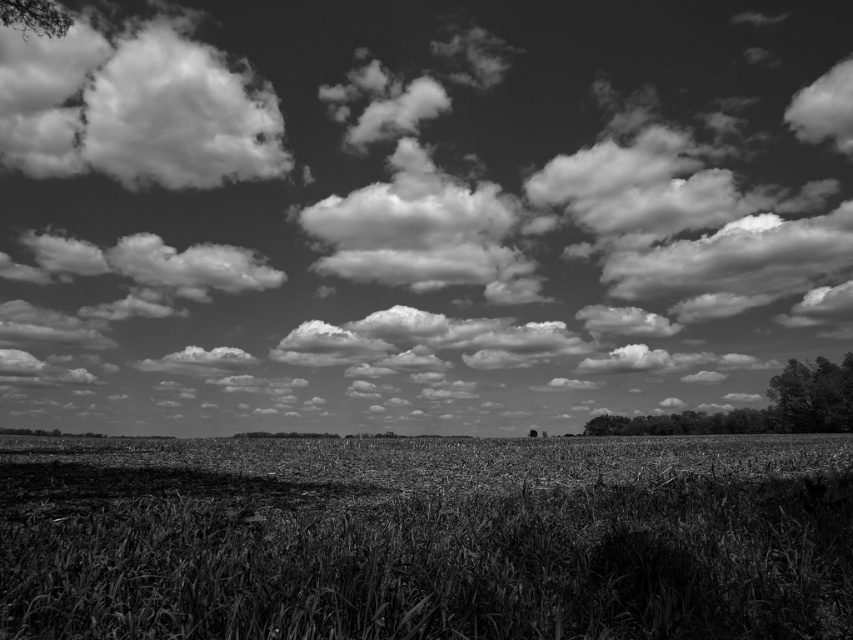
You are a photographer trying to capture the cloudy sky at upper center and the fluffy white cloud at upper left in your shot. Which of these two objects is bigger in the image?

The cloudy sky at upper center is larger in size than the fluffy white cloud at upper left.

You are a photographer aiming to capture the dark green textured tree at right and the dark textured tree at upper left in a single frame. Based on their sizes in the image, which tree would appear closer to the camera?

The dark green textured tree at right appears closer to the camera because it is larger in size than the dark textured tree at upper left.